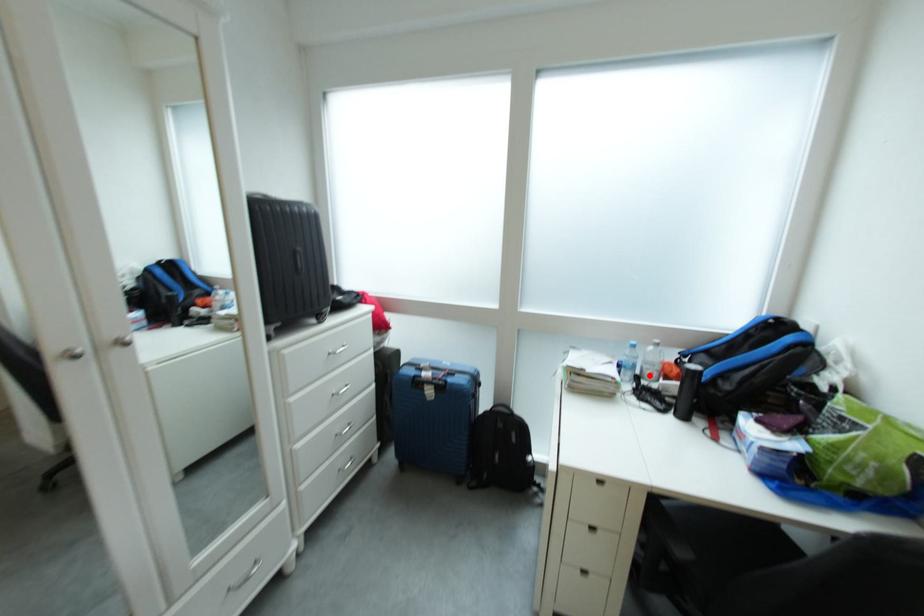
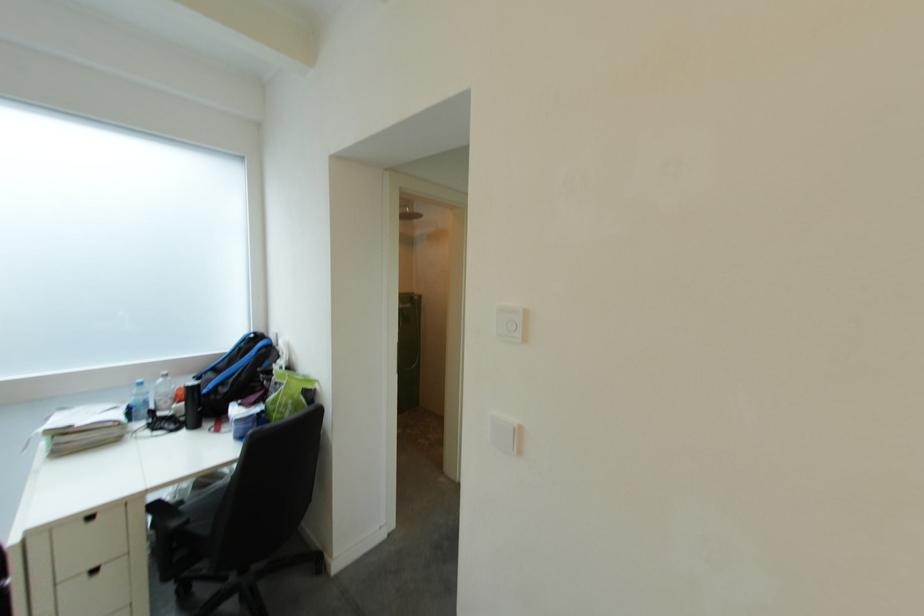
The point at the highlighted location is marked in the first image. Where is the corresponding point in the second image?

(163, 410)